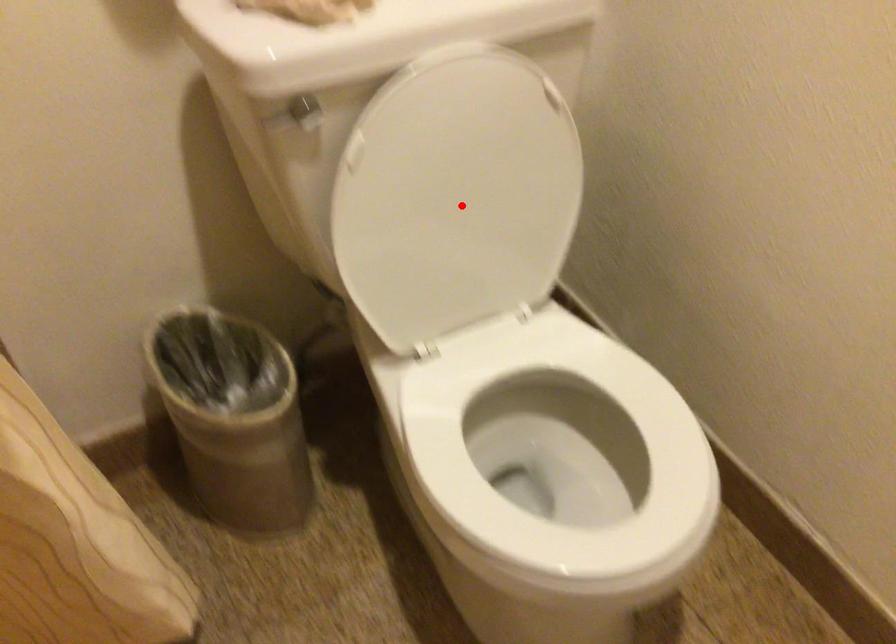
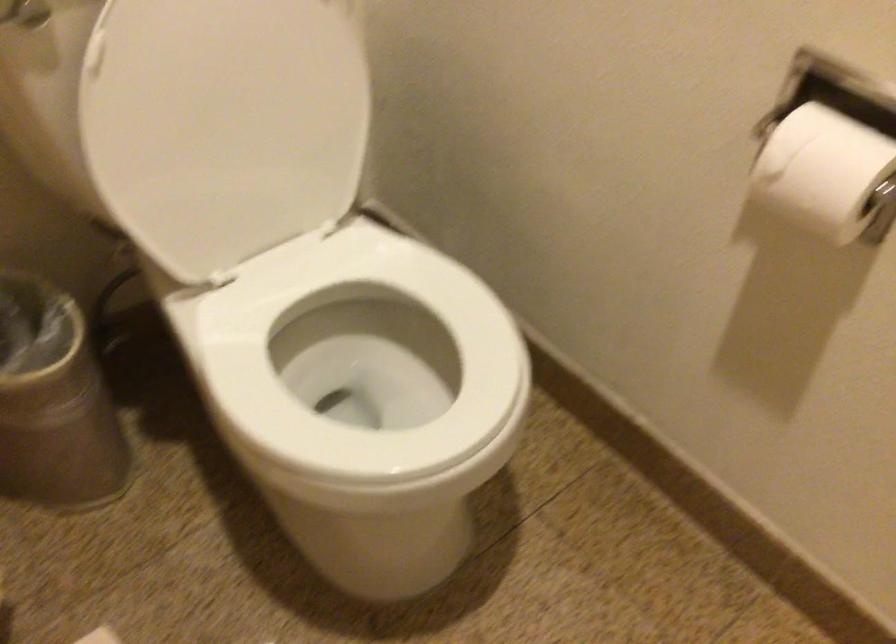
Find the pixel in the second image that matches the highlighted location in the first image.

(239, 114)